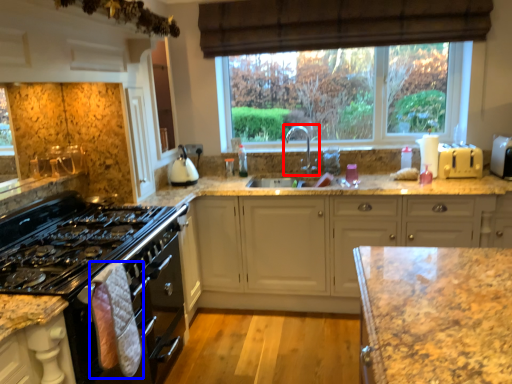
Question: Which object is closer to the camera taking this photo, tap (highlighted by a red box) or material (highlighted by a blue box)?

Choices:
 (A) tap
 (B) material

Answer: (B)